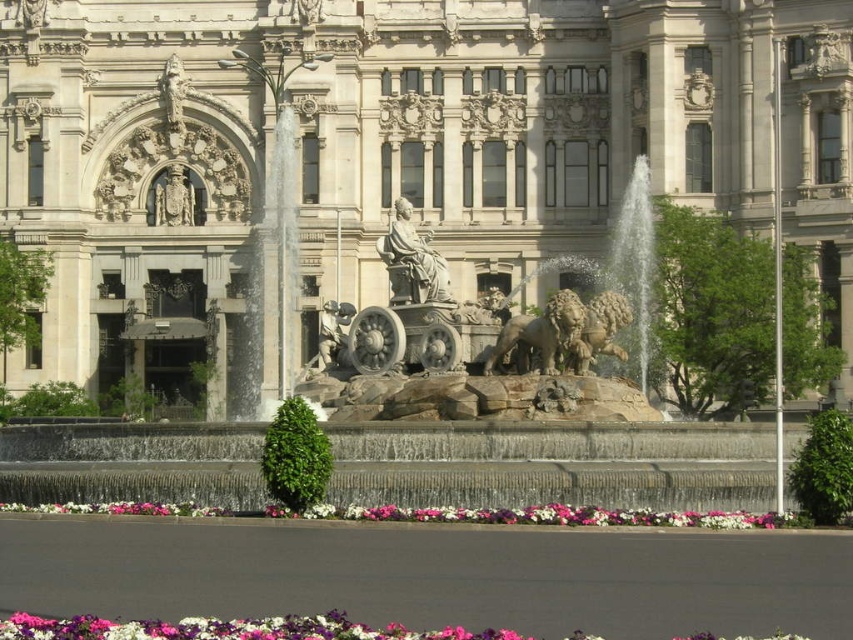
Question: Is stone sculpture at center smaller than pink-white floral border at center?

Choices:
 (A) yes
 (B) no

Answer: (B)

Question: Among these objects, which one is nearest to the camera?

Choices:
 (A) purple fabric flowers at lower center
 (B) pink-white floral border at center
 (C) polished bronze statue at upper center
 (D) stone lion at center

Answer: (A)

Question: Which point is closer to the camera?

Choices:
 (A) stone lion at center
 (B) stone sculpture at center

Answer: (A)

Question: Is stone sculpture at center bigger than white marble statue at center?

Choices:
 (A) no
 (B) yes

Answer: (B)

Question: Which is nearer to the white marble statue at center?

Choices:
 (A) pink-white floral border at center
 (B) purple fabric flowers at lower center
 (C) polished bronze statue at upper center
 (D) stone lion at center

Answer: (D)

Question: Does stone sculpture at center appear on the right side of polished bronze statue at upper center?

Choices:
 (A) yes
 (B) no

Answer: (A)